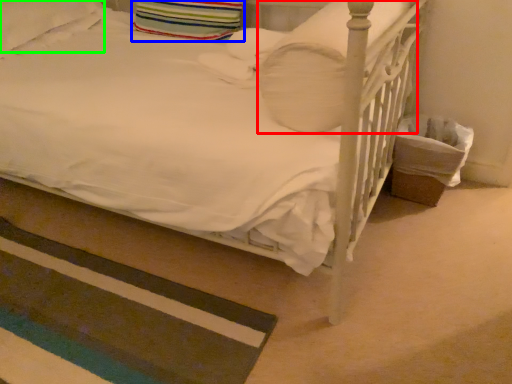
Question: Which is nearer to the pillow (highlighted by a red box)? pillow (highlighted by a blue box) or pillow (highlighted by a green box).

Choices:
 (A) pillow
 (B) pillow

Answer: (A)